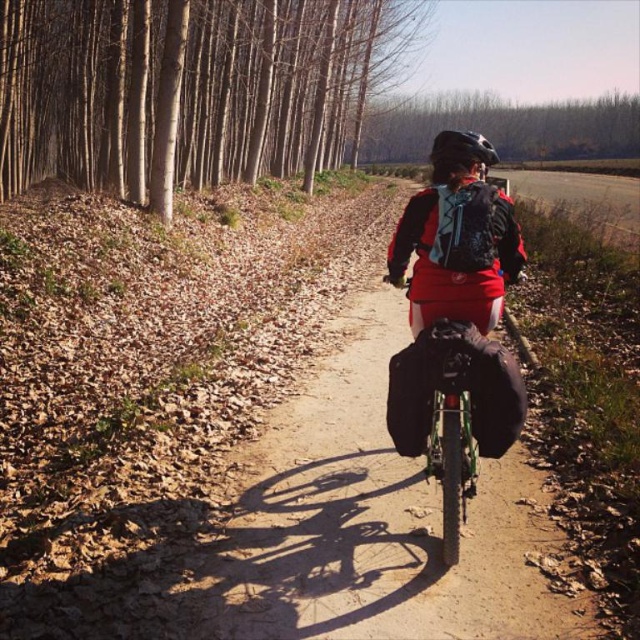
Which of these two, matte black jacket at center or matte black helmet at center, stands taller?

Standing taller between the two is matte black helmet at center.

This screenshot has width=640, height=640. Identify the location of matte black jacket at center. (456, 324).

Which is in front, point (493, 358) or point (460, 163)?

Positioned in front is point (493, 358).

You are a GUI agent. You are given a task and a screenshot of the screen. Output one action in this format:
    pyautogui.click(x=<x>, y=<y>)
    Task: Click on the matte black jacket at center
    Image resolution: width=640 pixels, height=640 pixels.
    Given the screenshot: What is the action you would take?
    pyautogui.click(x=456, y=324)